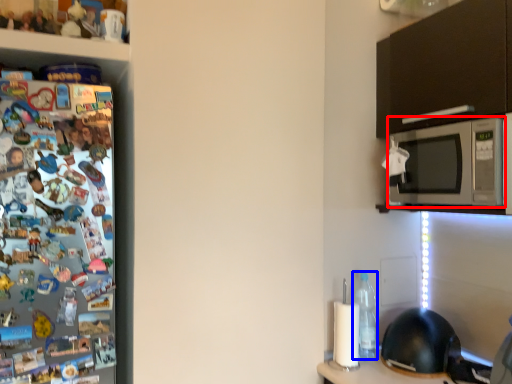
Question: Which object appears farthest to the camera in this image, microwave oven (highlighted by a red box) or bottle (highlighted by a blue box)?

Choices:
 (A) microwave oven
 (B) bottle

Answer: (B)